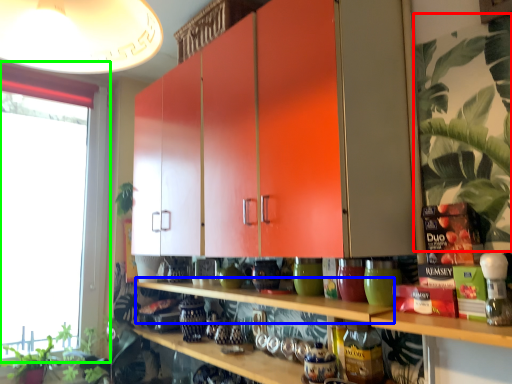
Question: Estimate the real-world distances between objects in this image. Which object is closer to plant (highlighted by a red box), shelf (highlighted by a blue box) or window (highlighted by a green box)?

Choices:
 (A) shelf
 (B) window

Answer: (A)